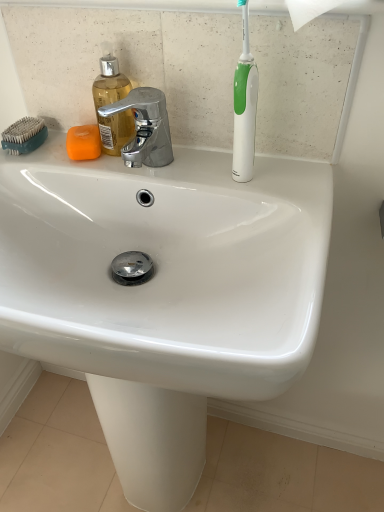
This screenshot has height=512, width=384. Identify the location of vacant space in front of teal plastic comb at upper left. (34, 160).